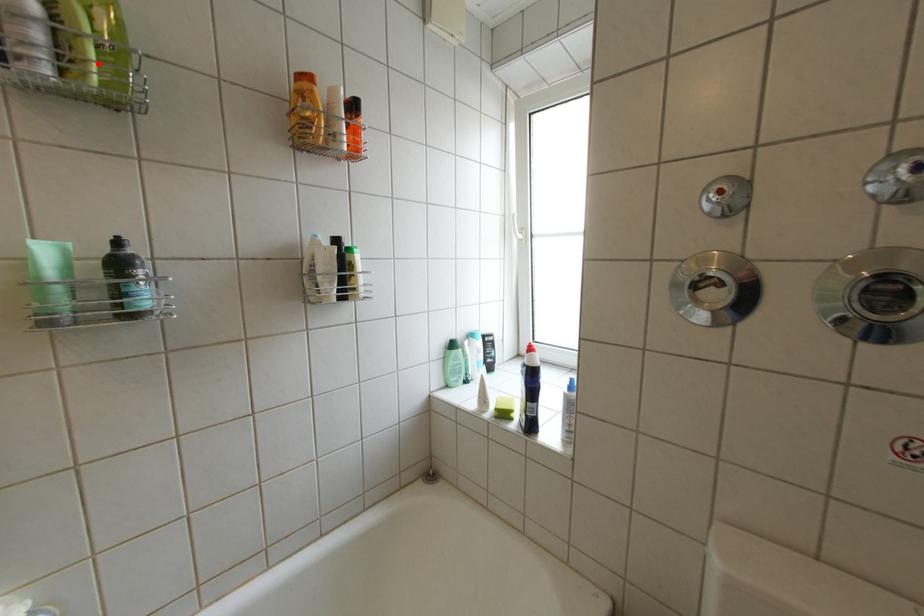
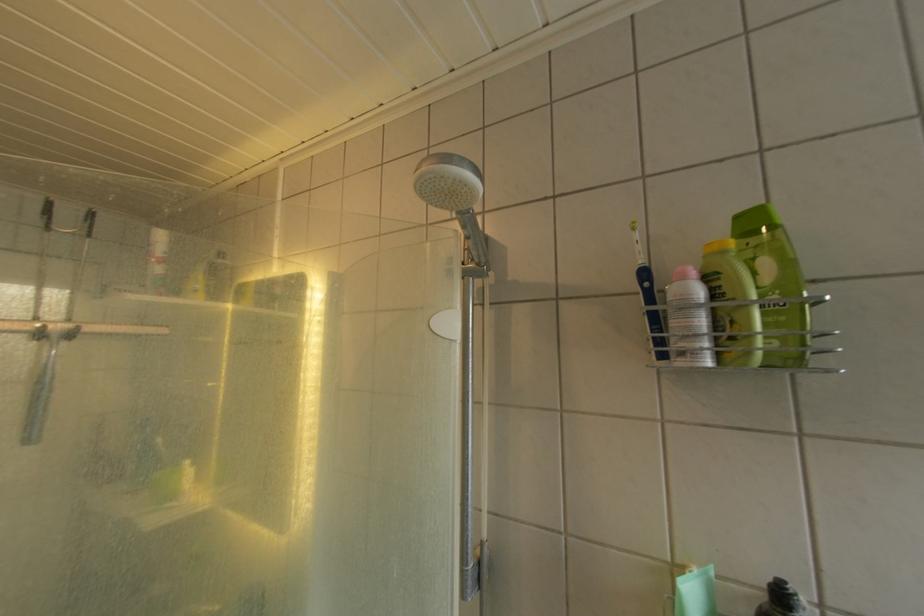
Where in the second image is the point corresponding to the highlighted location from the first image?

(763, 338)